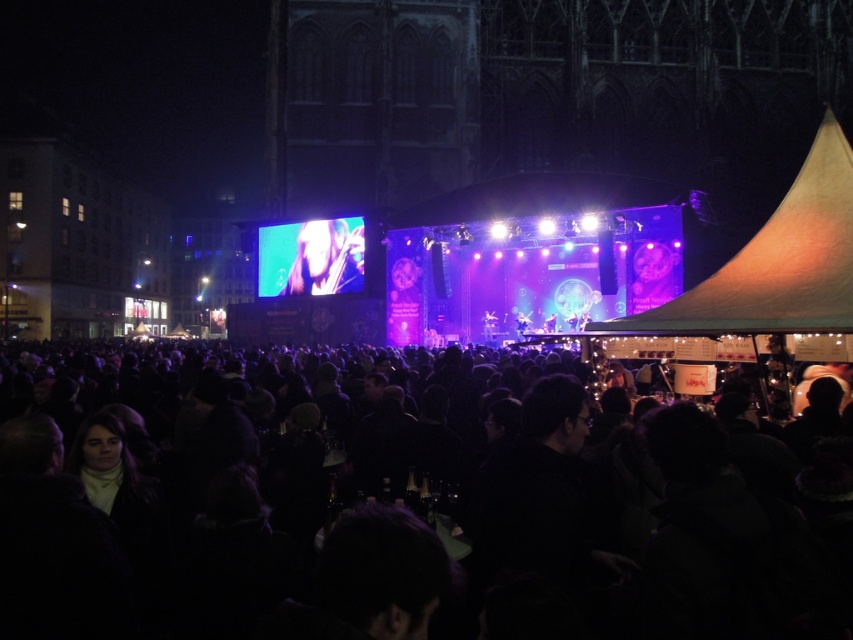
You are a photographer standing in the crowd at the concert. You want to take a photo of the smooth skin face at center without the black matte crowd at center blocking the view. Is it possible to do so?

The black matte crowd at center is closer to the viewer than the smooth skin face at center, so the crowd would block the view of the face. It is not possible to take a photo of the smooth skin face at center without the black matte crowd at center blocking the view.

You are a photographer at the concert and want to capture a photo of the smooth skin face at center without the black matte crowd at center blocking it. Based on their positions, is this possible?

The black matte crowd at center is to the right of the smooth skin face at center, so if you move your camera to the left side of the smooth skin face at center, you can avoid the black matte crowd at center and capture the face without obstruction.

You are standing at the center of the concert square and want to take a photo. There are two points of interest marked as point 1 at coordinates point (788, 570) and point 2 at coordinates point (323, 262). Which point should you focus on to capture a clearer image if you want the closest object in your frame?

Point 1 at coordinates point (788, 570) is closer to the camera, so focusing on it will capture a clearer image of the closest object.